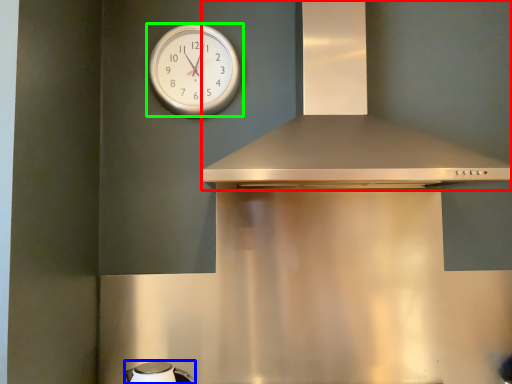
Question: Considering the real-world distances, which object is closest to vent (highlighted by a red box)? appliance (highlighted by a blue box) or wall clock (highlighted by a green box).

Choices:
 (A) appliance
 (B) wall clock

Answer: (B)